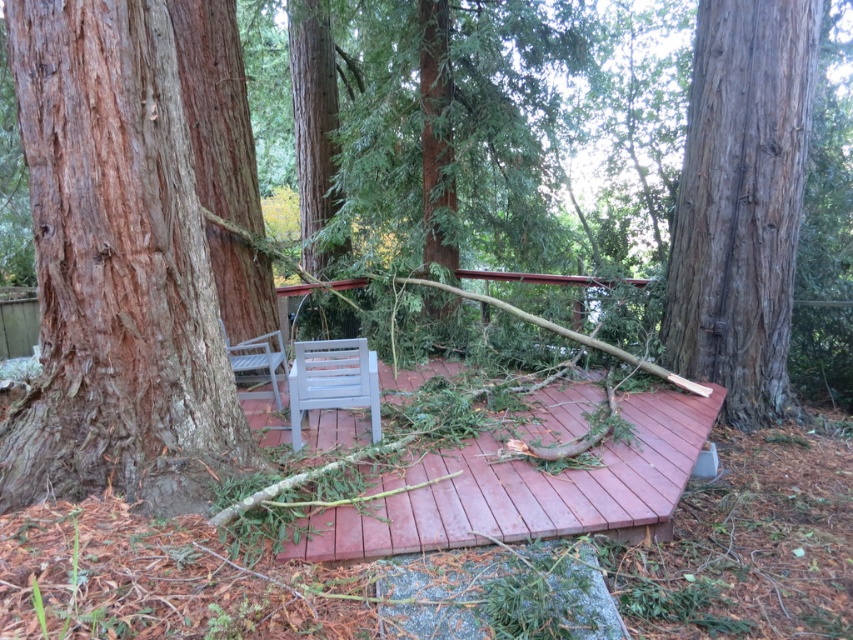
You are planning to place a 10 feet long table between the smooth brown tree trunk at right and the white plastic chair at center. Will the table fit between them?

The smooth brown tree trunk at right is 9.64 feet from the white plastic chair at center. Since the table is 10 feet long, it will not fit between them as the distance is slightly shorter than the table.

You are standing at the origin point of the image coordinate system. Where is the brown wood deck at center located in terms of coordinates?

The brown wood deck at center is located at coordinates point (527, 490).

You are a gardener assessing the damage after a storm. You see the smooth brown tree trunk at right and the white plastic chair at center. Which object is bigger in size?

The smooth brown tree trunk at right has a larger size compared to the white plastic chair at center.